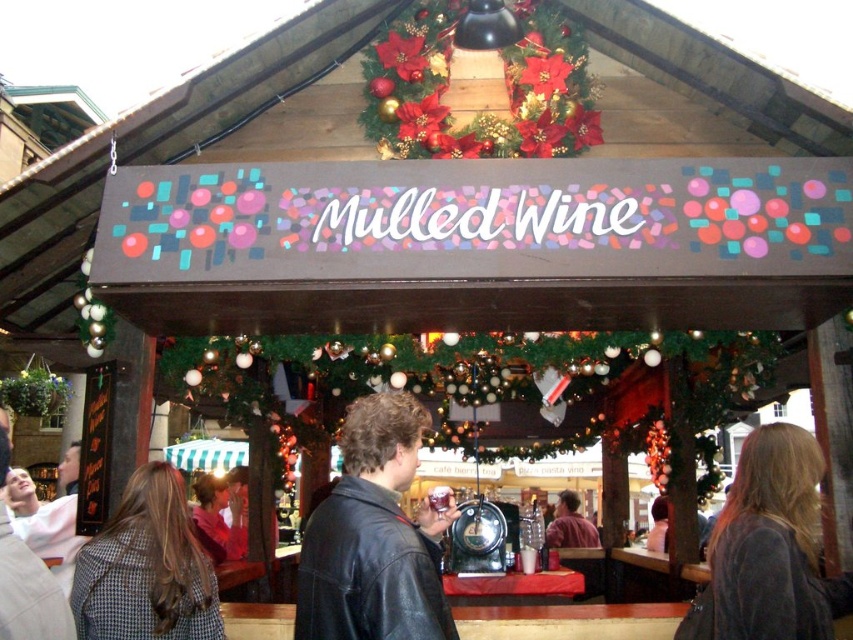
Who is more forward, (386, 602) or (415, 29)?

Positioned in front is point (386, 602).

Where is `leather jacket at center`? Image resolution: width=853 pixels, height=640 pixels. leather jacket at center is located at coordinates (374, 536).

Does red velvet wreath at upper center appear under matte brown leather jacket at center?

No, red velvet wreath at upper center is not below matte brown leather jacket at center.

What do you see at coordinates (480, 112) in the screenshot? I see `red velvet wreath at upper center` at bounding box center [480, 112].

Is point (431, 6) positioned before point (575, 516)?

Yes, it is.

Locate an element on the screen. Image resolution: width=853 pixels, height=640 pixels. red velvet wreath at upper center is located at coordinates (480, 112).

Who is shorter, leather jacket at center or matte brown leather jacket at center?

matte brown leather jacket at center

Is leather jacket at center thinner than matte brown leather jacket at center?

In fact, leather jacket at center might be wider than matte brown leather jacket at center.

I want to click on leather jacket at center, so click(374, 536).

Where is `leather jacket at center`? leather jacket at center is located at coordinates [374, 536].